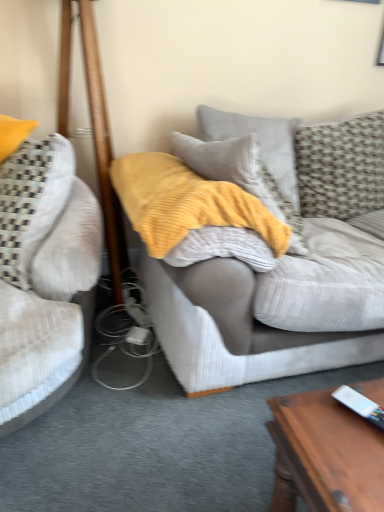
Question: Is textured beige pillow at upper right, which ranks as the second pillow in left-to-right order, closer to camera compared to wooden pole at left?

Choices:
 (A) yes
 (B) no

Answer: (B)

Question: Does textured beige pillow at upper right, the first pillow when ordered from right to left, have a greater width compared to wooden pole at left?

Choices:
 (A) yes
 (B) no

Answer: (B)

Question: Can you confirm if textured beige pillow at upper right, the first pillow when ordered from right to left, is positioned to the right of wooden pole at left?

Choices:
 (A) no
 (B) yes

Answer: (B)

Question: Does textured beige pillow at upper right, the first pillow when ordered from right to left, touch wooden pole at left?

Choices:
 (A) yes
 (B) no

Answer: (B)

Question: Is textured beige pillow at upper right, which ranks as the second pillow in left-to-right order, not within wooden pole at left?

Choices:
 (A) no
 (B) yes

Answer: (B)

Question: Is white plastic remote control at lower right taller or shorter than textured gray pillow at upper right, acting as the 1th pillow starting from the left?

Choices:
 (A) short
 (B) tall

Answer: (A)

Question: Considering the positions of white plastic remote control at lower right and textured gray pillow at upper right, placed as the second pillow when sorted from right to left, in the image, is white plastic remote control at lower right wider or thinner than textured gray pillow at upper right, placed as the second pillow when sorted from right to left,?

Choices:
 (A) wide
 (B) thin

Answer: (A)

Question: Based on their sizes in the image, would you say white plastic remote control at lower right is bigger or smaller than textured gray pillow at upper right, acting as the 1th pillow starting from the left?

Choices:
 (A) big
 (B) small

Answer: (B)

Question: Is white plastic remote control at lower right inside the boundaries of textured gray pillow at upper right, acting as the 1th pillow starting from the left, or outside?

Choices:
 (A) outside
 (B) inside

Answer: (A)

Question: Is point (97, 240) positioned closer to the camera than point (261, 126)?

Choices:
 (A) farther
 (B) closer

Answer: (B)

Question: In the image, is velvet beige couch at left, which is the 2th studio couch from right to left, positioned in front of or behind textured gray pillow at upper right, acting as the 1th pillow starting from the left?

Choices:
 (A) front
 (B) behind

Answer: (A)

Question: In the image, is velvet beige couch at left, which is the 2th studio couch from right to left, on the left side or the right side of textured gray pillow at upper right, acting as the 1th pillow starting from the left?

Choices:
 (A) left
 (B) right

Answer: (A)

Question: From a real-world perspective, relative to textured gray pillow at upper right, placed as the second pillow when sorted from right to left, is velvet beige couch at left, the 1th studio couch when ordered from left to right, vertically above or below?

Choices:
 (A) above
 (B) below

Answer: (B)

Question: Looking at their shapes, would you say velvet beige couch at left, the 1th studio couch when ordered from left to right, is wider or thinner than wooden pole at left?

Choices:
 (A) wide
 (B) thin

Answer: (B)

Question: From their relative heights in the image, would you say velvet beige couch at left, which is the 2th studio couch from right to left, is taller or shorter than wooden pole at left?

Choices:
 (A) short
 (B) tall

Answer: (A)